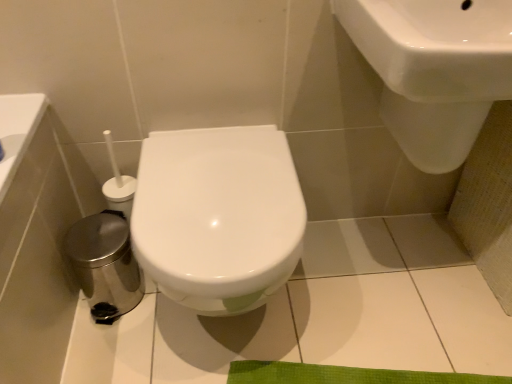
In order to face white glossy sink at upper right, should I rotate leftwards or rightwards?

You should look right and rotate roughly 26.462 degrees.

Consider the image. What is the approximate width of white glossy sink at upper right?

white glossy sink at upper right is 18.65 inches in width.

What do you see at coordinates (434, 70) in the screenshot? The height and width of the screenshot is (384, 512). I see `white glossy sink at upper right` at bounding box center [434, 70].

I want to click on white glossy sink at upper right, so click(x=434, y=70).

Describe the element at coordinates (218, 216) in the screenshot. The height and width of the screenshot is (384, 512). I see `white glossy toilet at center` at that location.

At what (x,y) coordinates should I click in order to perform the action: click on white glossy toilet at center. Please return your answer as a coordinate pair (x, y). The width and height of the screenshot is (512, 384). Looking at the image, I should click on (218, 216).

Image resolution: width=512 pixels, height=384 pixels. In order to click on white glossy sink at upper right in this screenshot , I will do `click(434, 70)`.

Is white glossy toilet at center to the right of white glossy sink at upper right from the viewer's perspective?

No.

Considering the positions of objects white glossy toilet at center and white glossy sink at upper right in the image provided, who is behind, white glossy toilet at center or white glossy sink at upper right?

white glossy toilet at center is further away from the camera.

Is point (289, 207) farther from camera compared to point (439, 148)?

That is False.

From the image's perspective, does white glossy toilet at center appear higher than white glossy sink at upper right?

No, from the image's perspective, white glossy toilet at center is not over white glossy sink at upper right.

From a real-world perspective, is white glossy toilet at center on top of white glossy sink at upper right?

No, from a real-world perspective, white glossy toilet at center is not above white glossy sink at upper right.

Is white glossy toilet at center thinner than white glossy sink at upper right?

In fact, white glossy toilet at center might be wider than white glossy sink at upper right.

Who is shorter, white glossy toilet at center or white glossy sink at upper right?

Standing shorter between the two is white glossy sink at upper right.

In the scene shown: Between white glossy toilet at center and white glossy sink at upper right, which one has larger size?

white glossy toilet at center.

Do you think white glossy toilet at center is within white glossy sink at upper right, or outside of it?

white glossy toilet at center is not enclosed by white glossy sink at upper right.

Are white glossy toilet at center and white glossy sink at upper right making contact?

white glossy toilet at center and white glossy sink at upper right are not in contact.

Is white glossy toilet at center oriented towards white glossy sink at upper right?

No, white glossy toilet at center is not turned towards white glossy sink at upper right.

Measure the distance from white glossy toilet at center to white glossy sink at upper right.

white glossy toilet at center and white glossy sink at upper right are 41.49 centimeters apart from each other.

Locate an element on the screen. The image size is (512, 384). sink on the right of the white glossy toilet at center is located at coordinates (434, 70).

Does white glossy sink at upper right appear on the left side of white glossy toilet at center?

No, white glossy sink at upper right is not to the left of white glossy toilet at center.

Is the depth of white glossy sink at upper right less than that of white glossy toilet at center?

Yes, white glossy sink at upper right is closer to the camera.

Is point (420, 131) less distant than point (199, 238)?

No, (420, 131) is further to viewer.

From the image's perspective, is white glossy sink at upper right on white glossy toilet at center?

Yes.

From a real-world perspective, does white glossy sink at upper right stand above white glossy toilet at center?

Yes, from a real-world perspective, white glossy sink at upper right is above white glossy toilet at center.

Which of these two, white glossy sink at upper right or white glossy toilet at center, is wider?

With larger width is white glossy toilet at center.

In terms of height, does white glossy sink at upper right look taller or shorter compared to white glossy toilet at center?

Clearly, white glossy sink at upper right is shorter compared to white glossy toilet at center.

Considering the sizes of white glossy sink at upper right and white glossy toilet at center in the image, is white glossy sink at upper right bigger or smaller than white glossy toilet at center?

Considering their sizes, white glossy sink at upper right takes up less space than white glossy toilet at center.

Is white glossy sink at upper right inside the boundaries of white glossy toilet at center, or outside?

The correct answer is: outside.

Are white glossy sink at upper right and white glossy toilet at center located far from each other?

white glossy sink at upper right is actually quite close to white glossy toilet at center.

Is white glossy sink at upper right turned away from white glossy toilet at center?

That's not correct — white glossy sink at upper right is not looking away from white glossy toilet at center.

You are a GUI agent. You are given a task and a screenshot of the screen. Output one action in this format:
    pyautogui.click(x=<x>, y=<y>)
    Task: Click on the sink lying on the right of white glossy toilet at center
    Image resolution: width=512 pixels, height=384 pixels.
    Given the screenshot: What is the action you would take?
    pyautogui.click(x=434, y=70)

This screenshot has width=512, height=384. I want to click on sink that is above the white glossy toilet at center (from a real-world perspective), so click(434, 70).

Identify the location of toilet beneath the white glossy sink at upper right (from a real-world perspective). The width and height of the screenshot is (512, 384). (218, 216).